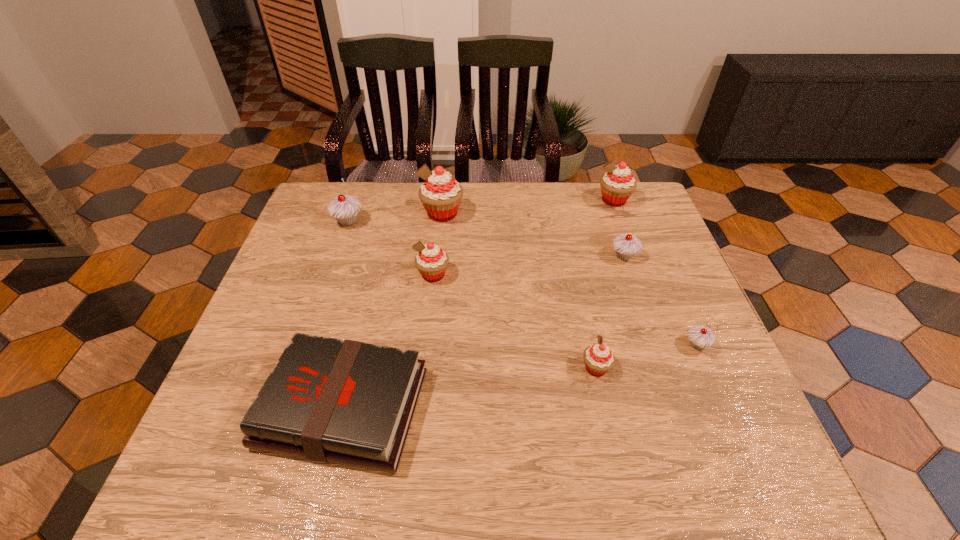
This screenshot has width=960, height=540. What are the coordinates of `the nearest pink cupcake` in the screenshot? It's located at (599, 359).

Locate an element on the screen. the second pink cupcake from right to left is located at coordinates (599, 359).

You are a GUI agent. You are given a task and a screenshot of the screen. Output one action in this format:
    pyautogui.click(x=<x>, y=<y>)
    Task: Click on the red hardback book
    
    Given the screenshot: What is the action you would take?
    pyautogui.click(x=330, y=400)

Identify the location of vacant position located on the front of the tallest object. The width and height of the screenshot is (960, 540). (436, 277).

The width and height of the screenshot is (960, 540). What are the coordinates of `free region located on the back of the farthest gray cupcake` in the screenshot? It's located at (358, 193).

The height and width of the screenshot is (540, 960). I want to click on vacant region located 0.190m on the left of the third smallest pink cupcake, so click(x=537, y=200).

You are a GUI agent. You are given a task and a screenshot of the screen. Output one action in this format:
    pyautogui.click(x=<x>, y=<y>)
    Task: Click on the blank area located on the front of the second nearest gray cupcake
    The image size is (960, 540).
    Given the screenshot: What is the action you would take?
    pyautogui.click(x=640, y=305)

Find the location of a particular element. vacant space located on the back of the third biggest pink cupcake is located at coordinates 440,214.

You are a GUI agent. You are given a task and a screenshot of the screen. Output one action in this format:
    pyautogui.click(x=<x>, y=<y>)
    Task: Click on the blank area located on the back of the nearest gray cupcake
    The image size is (960, 540).
    Given the screenshot: What is the action you would take?
    pyautogui.click(x=672, y=288)

The image size is (960, 540). I want to click on free space located on the back of the fourth object from right to left, so click(572, 261).